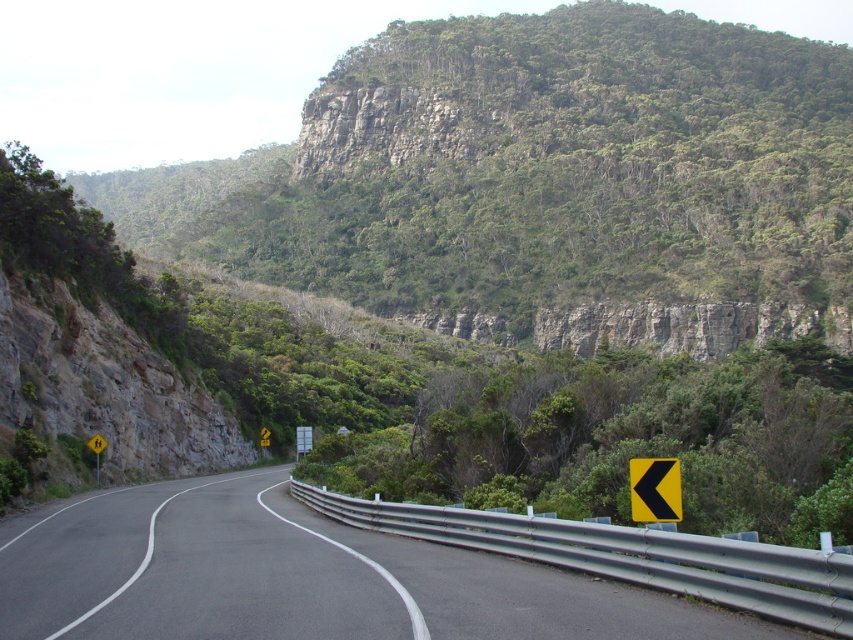
Question: Where is yellow reflective plastic at right located in relation to yellow reflective plastic at left in the image?

Choices:
 (A) above
 (B) below

Answer: (A)

Question: Which point is farther to the camera?

Choices:
 (A) (755, 88)
 (B) (650, 518)

Answer: (A)

Question: Does yellow reflective plastic at right appear under yellow reflective plastic at left?

Choices:
 (A) no
 (B) yes

Answer: (A)

Question: Based on their relative distances, which object is farther from the black asphalt road at center?

Choices:
 (A) yellow reflective plastic at left
 (B) green rocky cliff at upper center

Answer: (B)

Question: Is green rocky cliff at upper center smaller than black asphalt road at center?

Choices:
 (A) no
 (B) yes

Answer: (A)

Question: Among these points, which one is nearest to the camera?

Choices:
 (A) (96, 452)
 (B) (637, 480)
 (C) (599, 609)
 (D) (701, 216)

Answer: (C)